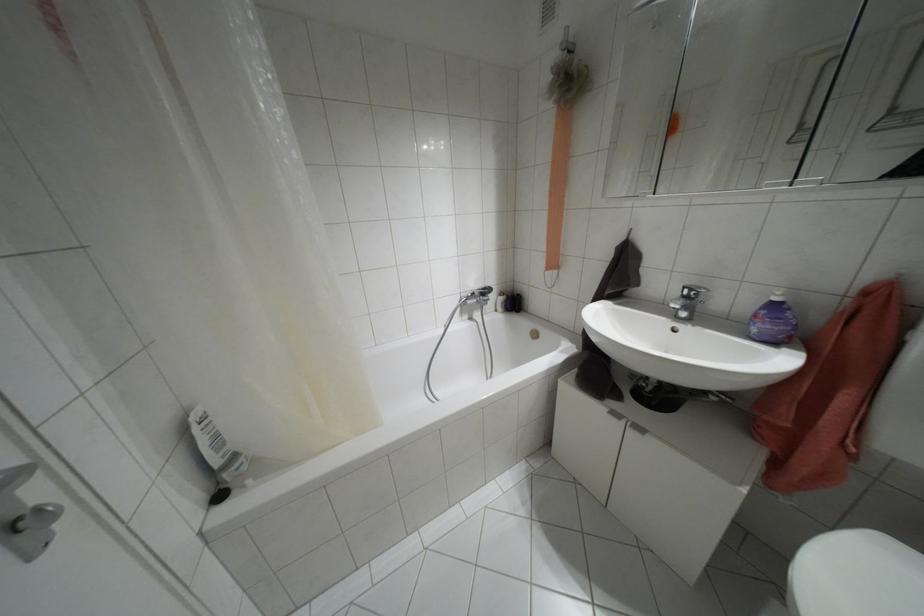
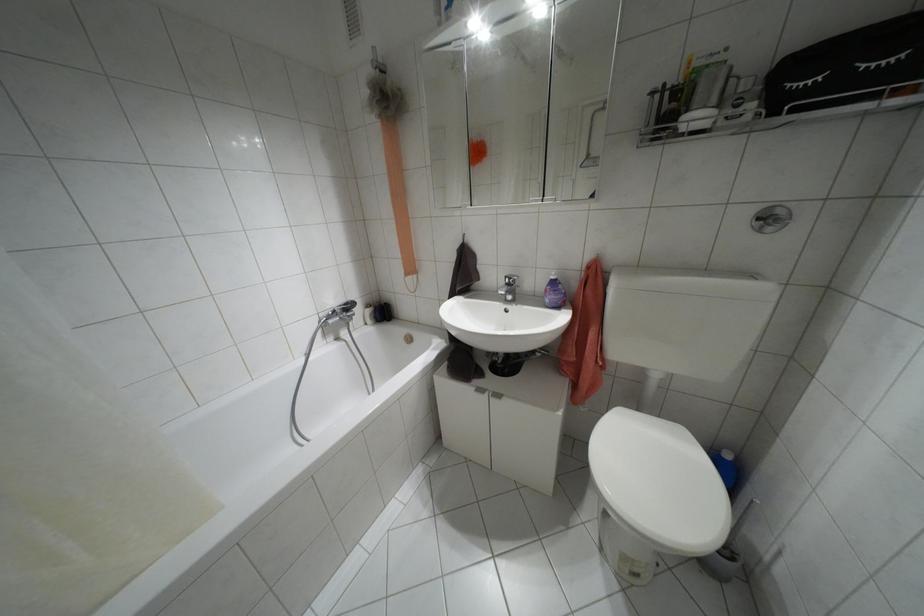
Find the pixel in the second image that matches (x=774, y=299) in the first image.

(552, 277)